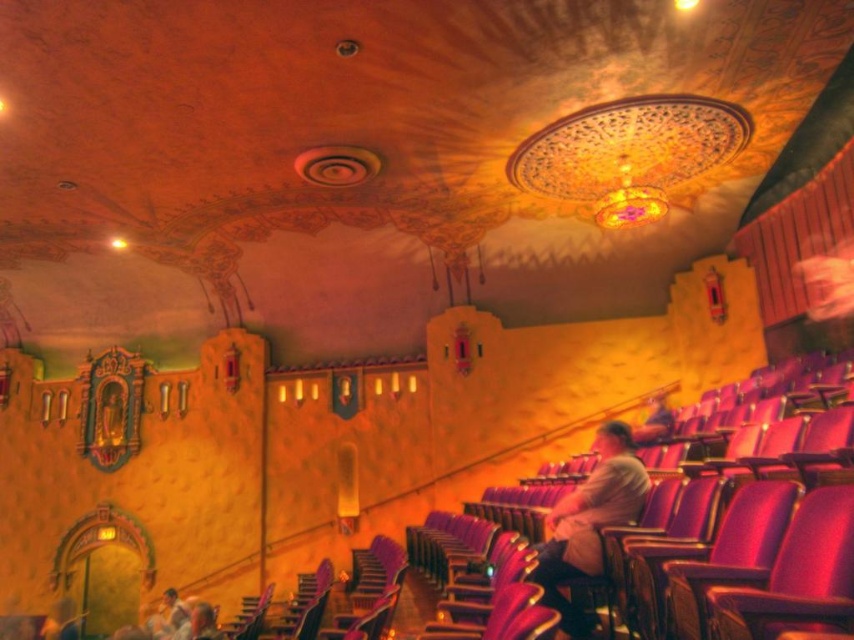
Question: Which point is closer to the camera taking this photo?

Choices:
 (A) (186, 612)
 (B) (199, 605)
 (C) (610, 424)

Answer: (C)

Question: Is light brown leather jacket at center bigger than light brown leather jacket at lower left?

Choices:
 (A) yes
 (B) no

Answer: (A)

Question: Among these points, which one is farthest from the camera?

Choices:
 (A) [x=168, y=620]
 (B) [x=208, y=609]
 (C) [x=574, y=611]

Answer: (A)

Question: Can you confirm if light brown leather jacket at center is bigger than light brown leather jacket at lower left?

Choices:
 (A) no
 (B) yes

Answer: (B)

Question: Is light brown leather jacket at lower left further to camera compared to matte gray hair at lower left?

Choices:
 (A) no
 (B) yes

Answer: (B)

Question: Among these points, which one is farthest from the camera?

Choices:
 (A) (197, 636)
 (B) (638, 460)
 (C) (151, 620)

Answer: (C)